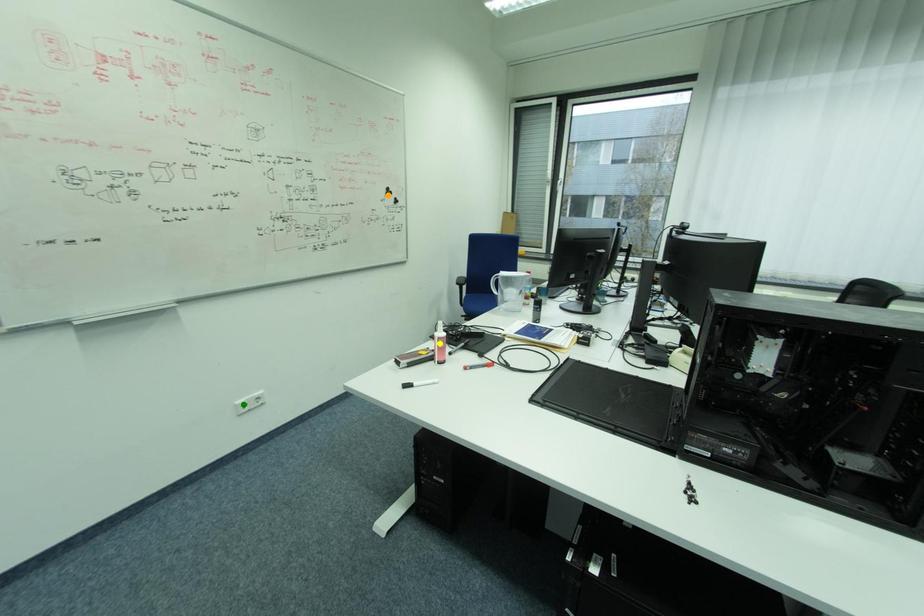
Order these from nearest to farthest:
orange point, green point, yellow point

1. yellow point
2. green point
3. orange point